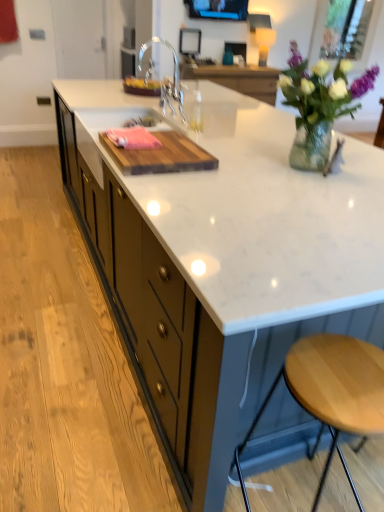
Question: Can you confirm if matte black tv at upper center, acting as the 1th window screen starting from the front, is taller than white marble countertop at center?

Choices:
 (A) no
 (B) yes

Answer: (A)

Question: Can you confirm if matte black tv at upper center, which appears as the second window screen when viewed from the back, is smaller than white marble countertop at center?

Choices:
 (A) no
 (B) yes

Answer: (B)

Question: Does matte black tv at upper center, acting as the 1th window screen starting from the front, appear on the right side of white marble countertop at center?

Choices:
 (A) yes
 (B) no

Answer: (A)

Question: Considering the relative sizes of matte black tv at upper center, positioned as the first window screen in left-to-right order, and white marble countertop at center in the image provided, is matte black tv at upper center, positioned as the first window screen in left-to-right order, wider than white marble countertop at center?

Choices:
 (A) no
 (B) yes

Answer: (A)

Question: Is matte black tv at upper center, which appears as the second window screen when viewed from the back, not near white marble countertop at center?

Choices:
 (A) yes
 (B) no

Answer: (A)

Question: Considering the relative sizes of matte black tv at upper center, arranged as the second window screen when viewed from the right, and white marble countertop at center in the image provided, is matte black tv at upper center, arranged as the second window screen when viewed from the right, shorter than white marble countertop at center?

Choices:
 (A) yes
 (B) no

Answer: (A)

Question: Is clear glass vase at upper right bigger than white marble countertop at center?

Choices:
 (A) yes
 (B) no

Answer: (B)

Question: Is clear glass vase at upper right to the left of white marble countertop at center from the viewer's perspective?

Choices:
 (A) no
 (B) yes

Answer: (A)

Question: Is clear glass vase at upper right shorter than white marble countertop at center?

Choices:
 (A) no
 (B) yes

Answer: (B)

Question: Is clear glass vase at upper right oriented away from white marble countertop at center?

Choices:
 (A) no
 (B) yes

Answer: (A)

Question: Is the position of clear glass vase at upper right less distant than that of white marble countertop at center?

Choices:
 (A) no
 (B) yes

Answer: (A)

Question: Is clear glass vase at upper right smaller than white marble countertop at center?

Choices:
 (A) no
 (B) yes

Answer: (B)

Question: Is wooden cutting board at center smaller than chrome metallic faucet at center?

Choices:
 (A) yes
 (B) no

Answer: (A)